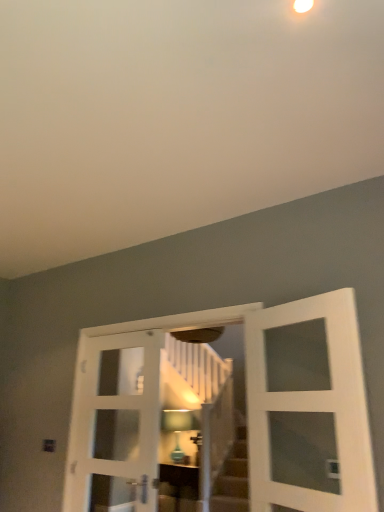
Question: From a real-world perspective, is matte glass lampshade at center positioned over white wooden door at center, positioned as the second door in left-to-right order, based on gravity?

Choices:
 (A) yes
 (B) no

Answer: (B)

Question: Considering the relative sizes of matte glass lampshade at center and white wooden door at center, positioned as the second door in left-to-right order, in the image provided, is matte glass lampshade at center thinner than white wooden door at center, positioned as the second door in left-to-right order,?

Choices:
 (A) no
 (B) yes

Answer: (A)

Question: Can you confirm if matte glass lampshade at center is wider than white wooden door at center, positioned as the second door in left-to-right order?

Choices:
 (A) no
 (B) yes

Answer: (B)

Question: Is matte glass lampshade at center not inside white wooden door at center, positioned as the second door in left-to-right order?

Choices:
 (A) no
 (B) yes

Answer: (B)

Question: Can you confirm if matte glass lampshade at center is bigger than white wooden door at center, which is counted as the second door, starting from the right?

Choices:
 (A) no
 (B) yes

Answer: (A)

Question: In the image, is matte brown cabinet at center positioned in front of or behind matte glass lampshade at center?

Choices:
 (A) behind
 (B) front

Answer: (B)

Question: Looking at their shapes, would you say matte brown cabinet at center is wider or thinner than matte glass lampshade at center?

Choices:
 (A) thin
 (B) wide

Answer: (B)

Question: Is matte brown cabinet at center to the left or to the right of matte glass lampshade at center in the image?

Choices:
 (A) left
 (B) right

Answer: (B)

Question: From the image's perspective, is matte brown cabinet at center positioned above or below matte glass lampshade at center?

Choices:
 (A) above
 (B) below

Answer: (B)

Question: Looking at the image, does white glass door at center, which appears as the 1th door when viewed from the right, seem bigger or smaller compared to white glass door at center, which appears as the 1th door when viewed from the left?

Choices:
 (A) small
 (B) big

Answer: (A)

Question: From a real-world perspective, is white glass door at center, which appears as the 1th door when viewed from the right, physically located above or below white glass door at center, marked as the 3th door in a right-to-left arrangement?

Choices:
 (A) above
 (B) below

Answer: (A)

Question: Considering their positions, is white glass door at center, the 3th door from the left, located in front of or behind white glass door at center, marked as the 3th door in a right-to-left arrangement?

Choices:
 (A) front
 (B) behind

Answer: (A)

Question: From their relative heights in the image, would you say white glass door at center, which appears as the 1th door when viewed from the right, is taller or shorter than white glass door at center, marked as the 3th door in a right-to-left arrangement?

Choices:
 (A) short
 (B) tall

Answer: (A)

Question: From a real-world perspective, is white glass door at center, which appears as the 1th door when viewed from the left, physically located above or below matte brown cabinet at center?

Choices:
 (A) below
 (B) above

Answer: (B)

Question: From the image's perspective, is white glass door at center, which appears as the 1th door when viewed from the left, above or below matte brown cabinet at center?

Choices:
 (A) above
 (B) below

Answer: (A)